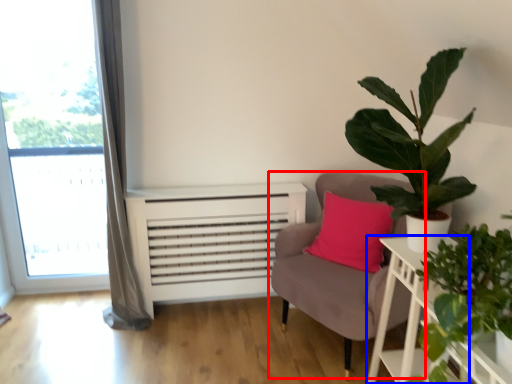
Question: Which of the following is the closest to the observer, chair (highlighted by a red box) or table (highlighted by a blue box)?

Choices:
 (A) chair
 (B) table

Answer: (B)